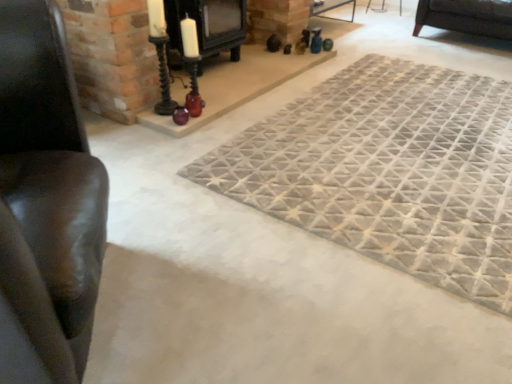
Describe the element at coordinates (206, 27) in the screenshot. The height and width of the screenshot is (384, 512). I see `black matte fireplace at upper center` at that location.

You are a GUI agent. You are given a task and a screenshot of the screen. Output one action in this format:
    pyautogui.click(x=<x>, y=<y>)
    Task: Click on the textured gray mat at center
    The width and height of the screenshot is (512, 384).
    Given the screenshot: What is the action you would take?
    pyautogui.click(x=388, y=171)

The width and height of the screenshot is (512, 384). I want to click on black matte fireplace at upper center, so click(206, 27).

Between black matte fireplace at upper center and leather couch at left, which one is positioned in front?

leather couch at left is in front.

How much distance is there between black matte fireplace at upper center and leather couch at left?

A distance of 1.64 meters exists between black matte fireplace at upper center and leather couch at left.

Considering the relative sizes of black matte fireplace at upper center and leather couch at left in the image provided, is black matte fireplace at upper center taller than leather couch at left?

In fact, black matte fireplace at upper center may be shorter than leather couch at left.

From the image's perspective, which one is positioned higher, black matte fireplace at upper center or leather couch at left?

black matte fireplace at upper center appears higher in the image.

Considering the relative positions of leather couch at left and black matte fireplace at upper center in the image provided, is leather couch at left to the right of black matte fireplace at upper center from the viewer's perspective?

Incorrect, leather couch at left is not on the right side of black matte fireplace at upper center.

Considering the sizes of leather couch at left and black matte fireplace at upper center in the image, is leather couch at left wider or thinner than black matte fireplace at upper center?

Clearly, leather couch at left has more width compared to black matte fireplace at upper center.

Considering the points (49, 213) and (233, 28), which point is behind, point (49, 213) or point (233, 28)?

Positioned behind is point (233, 28).

Does leather couch at left turn towards black matte fireplace at upper center?

No, leather couch at left is not turned towards black matte fireplace at upper center.

Who is smaller, textured gray mat at center or black matte fireplace at upper center?

Smaller between the two is black matte fireplace at upper center.

Is textured gray mat at center to the left of black matte fireplace at upper center from the viewer's perspective?

No.

In terms of height, does textured gray mat at center look taller or shorter compared to black matte fireplace at upper center?

Considering their sizes, textured gray mat at center has less height than black matte fireplace at upper center.

Is point (471, 226) in front of point (227, 4)?

Yes, it is in front of point (227, 4).

Is black matte fireplace at upper center situated inside textured gray mat at center or outside?

black matte fireplace at upper center is outside textured gray mat at center.

Considering the points (169, 33) and (450, 148), which point is behind, point (169, 33) or point (450, 148)?

The point (169, 33) is behind.

Considering the positions of objects black matte fireplace at upper center and textured gray mat at center in the image provided, who is in front, black matte fireplace at upper center or textured gray mat at center?

textured gray mat at center is more forward.

Which of these two, black matte fireplace at upper center or textured gray mat at center, is wider?

Wider between the two is textured gray mat at center.

Could you tell me if leather couch at left is turned towards textured gray mat at center?

Yes, leather couch at left is aimed at textured gray mat at center.

Is point (52, 330) in front of point (362, 114)?

Yes, point (52, 330) is in front of point (362, 114).

Would you say leather couch at left is outside textured gray mat at center?

Yes, leather couch at left is located beyond the bounds of textured gray mat at center.

Is there a large distance between leather couch at left and textured gray mat at center?

Indeed, leather couch at left is not near textured gray mat at center.

Consider the image. Which is closer, [464,163] or [36,159]?

Positioned in front is point [36,159].

From a real-world perspective, is textured gray mat at center located beneath leather couch at left?

Yes, from a real-world perspective, textured gray mat at center is below leather couch at left.

Consider the image. Would you say textured gray mat at center contains leather couch at left?

No, leather couch at left is not surrounded by textured gray mat at center.

Does textured gray mat at center have a larger size compared to leather couch at left?

No.

The width and height of the screenshot is (512, 384). Identify the location of furniture in front of the black matte fireplace at upper center. (45, 203).

Image resolution: width=512 pixels, height=384 pixels. Find the location of `furniture below the black matte fireplace at upper center (from the image's perspective)`. furniture below the black matte fireplace at upper center (from the image's perspective) is located at coordinates 45,203.

Estimate the real-world distances between objects in this image. Which object is closer to black matte fireplace at upper center, leather couch at left or textured gray mat at center?

textured gray mat at center is positioned closer to the anchor black matte fireplace at upper center.

Estimate the real-world distances between objects in this image. Which object is closer to textured gray mat at center, leather couch at left or black matte fireplace at upper center?

black matte fireplace at upper center lies closer to textured gray mat at center than the other object.

From the image, which object appears to be nearer to textured gray mat at center, black matte fireplace at upper center or leather couch at left?

black matte fireplace at upper center.

When comparing their distances from leather couch at left, does textured gray mat at center or black matte fireplace at upper center seem closer?

textured gray mat at center.

Considering their positions, is black matte fireplace at upper center positioned further to leather couch at left than textured gray mat at center?

Based on the image, black matte fireplace at upper center appears to be further to leather couch at left.

Which object lies further to the anchor point black matte fireplace at upper center, textured gray mat at center or leather couch at left?

leather couch at left lies further to black matte fireplace at upper center than the other object.

I want to click on mat between leather couch at left and black matte fireplace at upper center along the z-axis, so click(388, 171).